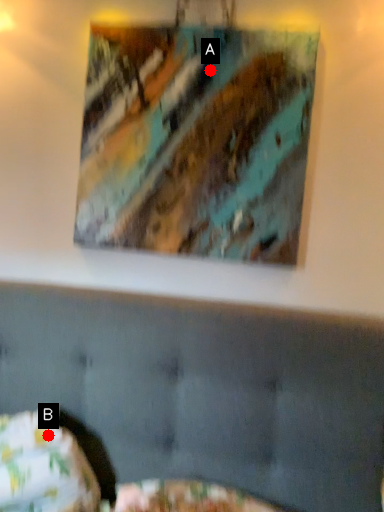
Question: Two points are circled on the image, labeled by A and B beside each circle. Which point is farther from the camera taking this photo?

Choices:
 (A) A is further
 (B) B is further

Answer: (A)